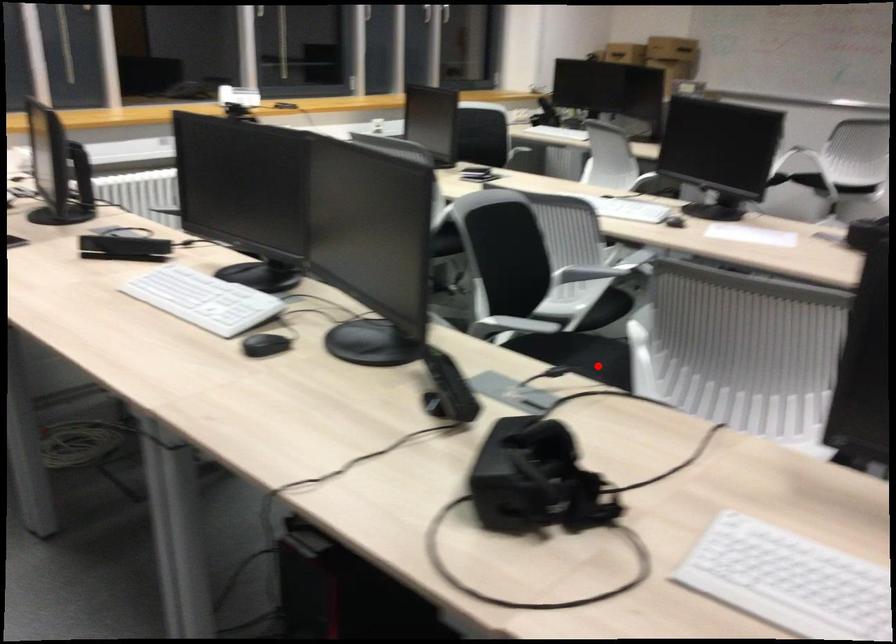
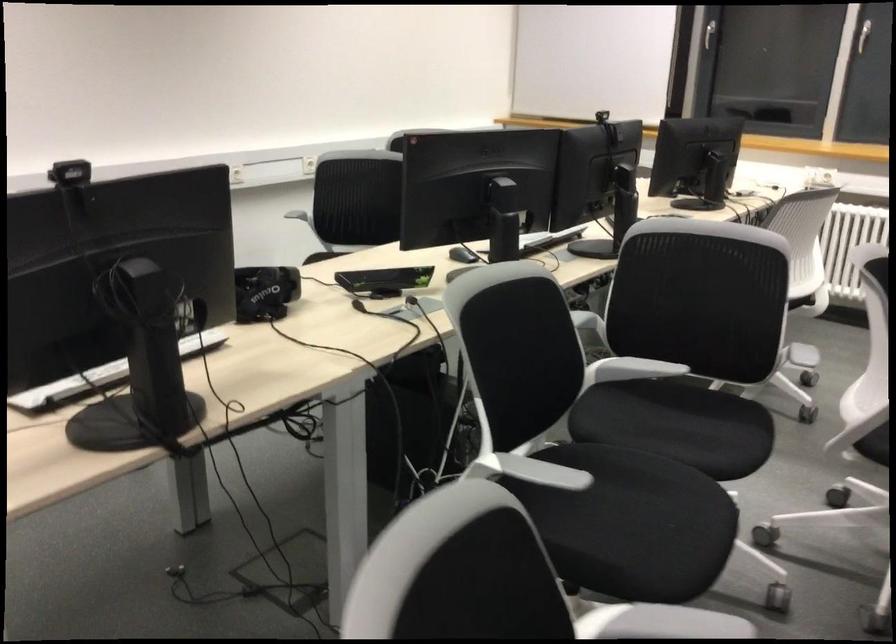
Question: I am providing you with two images of the same scene from different viewpoints. In image1, a red point is highlighted. Considering the same 3D point in image2, which of the following is correct?

Choices:
 (A) It is closer
 (B) It is farther

Answer: (A)